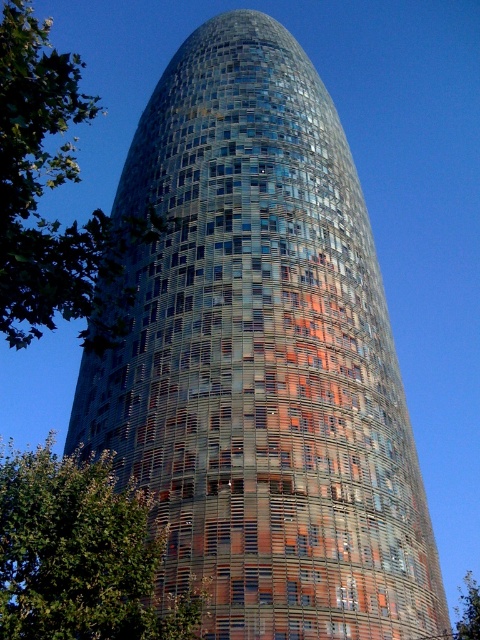
Question: Is green leafy tree at left wider than green leafy tree at lower left?

Choices:
 (A) no
 (B) yes

Answer: (A)

Question: Among these objects, which one is nearest to the camera?

Choices:
 (A) green leafy tree at left
 (B) green leafy tree at upper left

Answer: (A)

Question: Which object appears farthest from the camera in this image?

Choices:
 (A) green leafy tree at upper left
 (B) green leafy tree at lower left
 (C) green leafy tree at left

Answer: (A)

Question: Is green leafy tree at left positioned at the back of green leafy tree at lower left?

Choices:
 (A) no
 (B) yes

Answer: (A)

Question: Which of the following is the closest to the observer?

Choices:
 (A) (468, 588)
 (B) (98, 236)
 (C) (122, 532)

Answer: (B)

Question: Can you confirm if green leafy tree at left is positioned below green leafy tree at lower left?

Choices:
 (A) yes
 (B) no

Answer: (B)